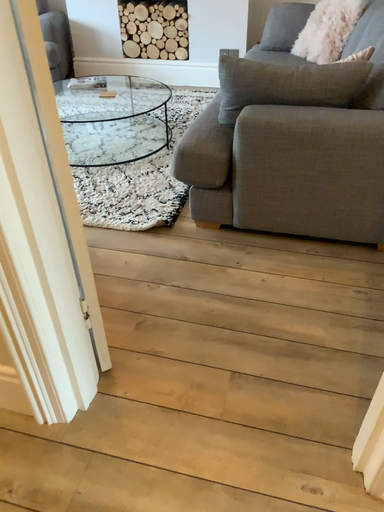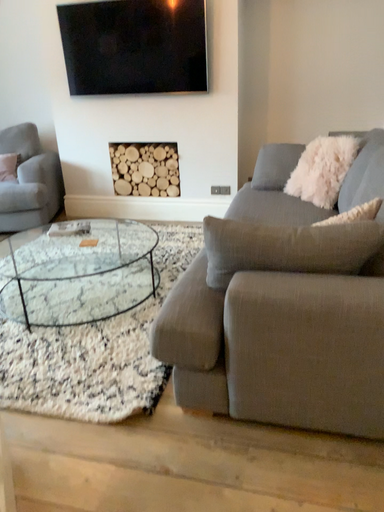
Question: Which way did the camera rotate in the video?

Choices:
 (A) rotated downward
 (B) rotated upward

Answer: (B)